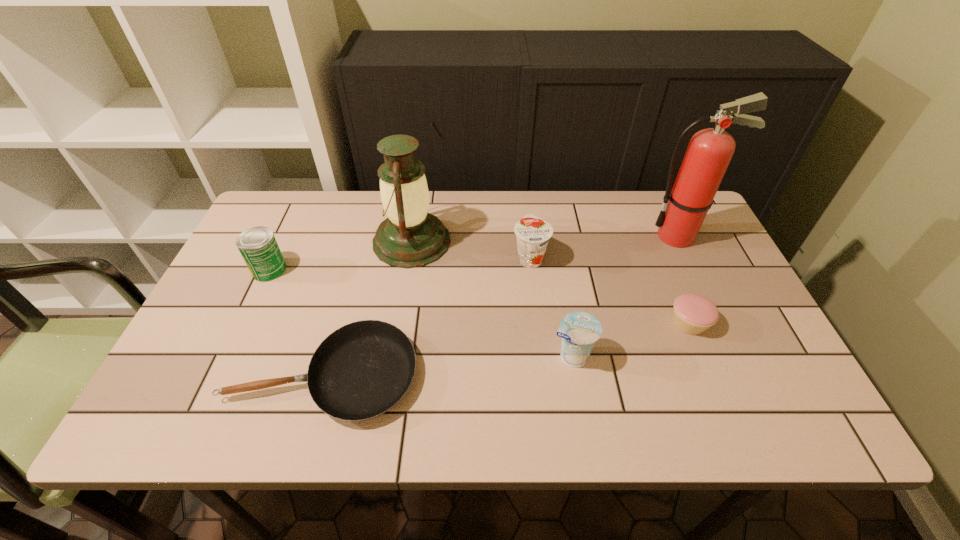
Locate an element on the screen. The image size is (960, 540). fire extinguisher is located at coordinates (709, 152).

I want to click on the sixth shortest object, so click(x=410, y=237).

I want to click on can, so click(x=258, y=246).

This screenshot has width=960, height=540. I want to click on the farther yogurt, so click(x=532, y=233).

Identify the location of the nearer yogurt. Image resolution: width=960 pixels, height=540 pixels. (579, 330).

The image size is (960, 540). Find the location of `the sixth tallest object`. the sixth tallest object is located at coordinates (693, 314).

This screenshot has width=960, height=540. In order to click on the shortest object in this screenshot , I will do `click(361, 370)`.

Locate an element on the screen. The height and width of the screenshot is (540, 960). free space located 0.050m on the hose direction of the fire extinguisher is located at coordinates (627, 236).

At what (x,y) coordinates should I click in order to perform the action: click on vacant space located 0.090m on the hose direction of the fire extinguisher. Please return your answer as a coordinate pair (x, y). The image size is (960, 540). Looking at the image, I should click on (613, 236).

At what (x,y) coordinates should I click in order to perform the action: click on free region located on the hose direction of the fire extinguisher. Please return your answer as a coordinate pair (x, y). Looking at the image, I should click on (576, 236).